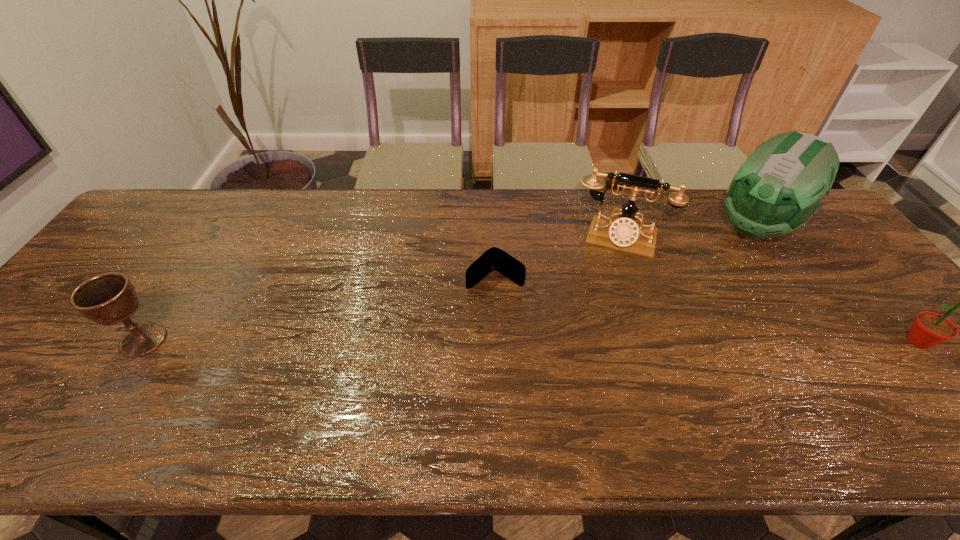
I want to click on vacant spot on the desktop that is between the leftmost object and the rightmost object and is positioned on the dial of the third object from right to left, so click(x=597, y=341).

Find the location of a particular element. This screenshot has width=960, height=540. vacant space on the desktop that is between the leftmost object and the rightmost object and is positioned on the outer surface of the fourth object from right to left is located at coordinates (425, 340).

What are the coordinates of `vacant spot on the desktop that is between the second shortest object and the sunflower and is positioned on the visor of the football helmet` in the screenshot? It's located at (639, 341).